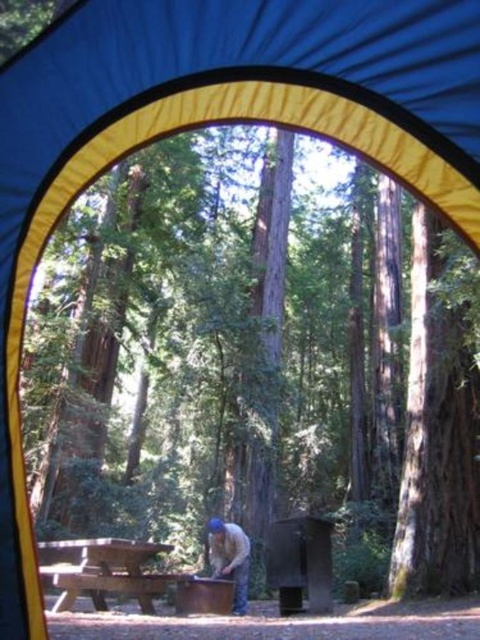
Question: Which of the following is the farthest from the observer?

Choices:
 (A) wooden picnic table at center
 (B) brown leather jacket at lower center

Answer: (B)

Question: Can you confirm if wooden picnic table at center is positioned below brown leather jacket at lower center?

Choices:
 (A) no
 (B) yes

Answer: (A)

Question: Is wooden picnic table at center above brown leather jacket at lower center?

Choices:
 (A) yes
 (B) no

Answer: (A)

Question: Does wooden picnic table at center have a smaller size compared to brown leather jacket at lower center?

Choices:
 (A) no
 (B) yes

Answer: (A)